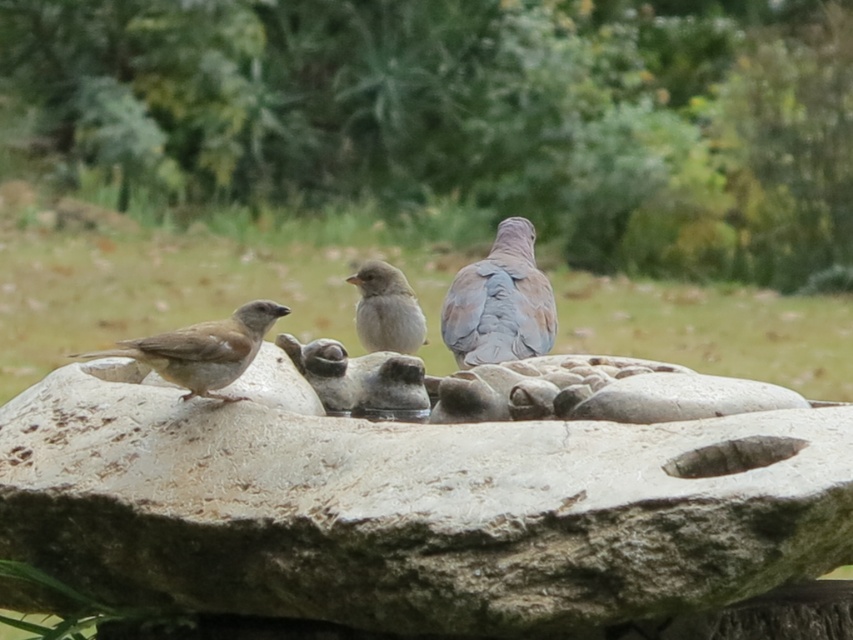
Question: Can you confirm if rough stone bird bath at center is wider than gray feathered dove at center?

Choices:
 (A) no
 (B) yes

Answer: (B)

Question: Does brown matte sparrow at left come in front of gray matte sparrow at center?

Choices:
 (A) no
 (B) yes

Answer: (B)

Question: Estimate the real-world distances between objects in this image. Which object is farther from the gray feathered dove at center?

Choices:
 (A) rough stone bird bath at center
 (B) gray matte sparrow at center
 (C) brown matte sparrow at left

Answer: (C)

Question: Is brown matte sparrow at left positioned before gray matte sparrow at center?

Choices:
 (A) no
 (B) yes

Answer: (B)

Question: Which of the following is the closest to the observer?

Choices:
 (A) gray matte sparrow at center
 (B) rough stone bird bath at center
 (C) brown matte sparrow at left

Answer: (B)

Question: Among these points, which one is farthest from the camera?

Choices:
 (A) pyautogui.click(x=405, y=435)
 (B) pyautogui.click(x=495, y=241)
 (C) pyautogui.click(x=370, y=296)

Answer: (B)